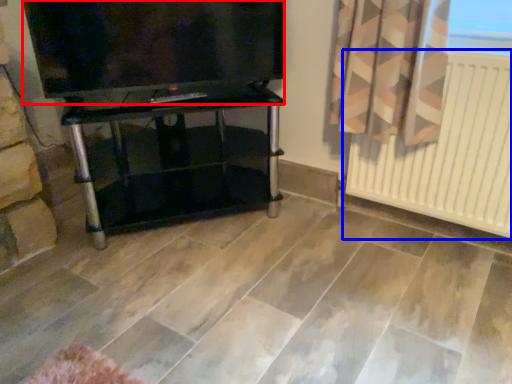
Question: Among these objects, which one is nearest to the camera, television (highlighted by a red box) or radiator (highlighted by a blue box)?

Choices:
 (A) television
 (B) radiator

Answer: (B)